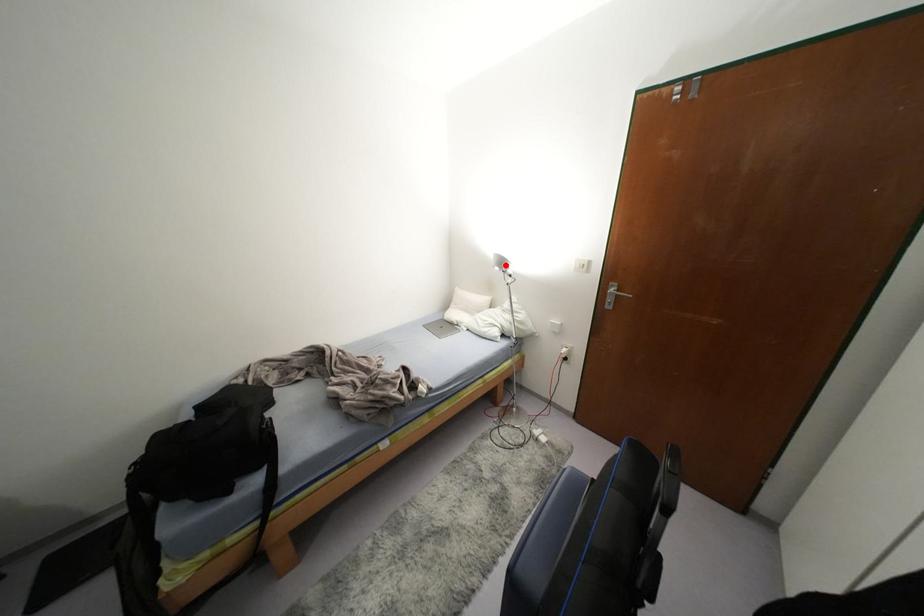
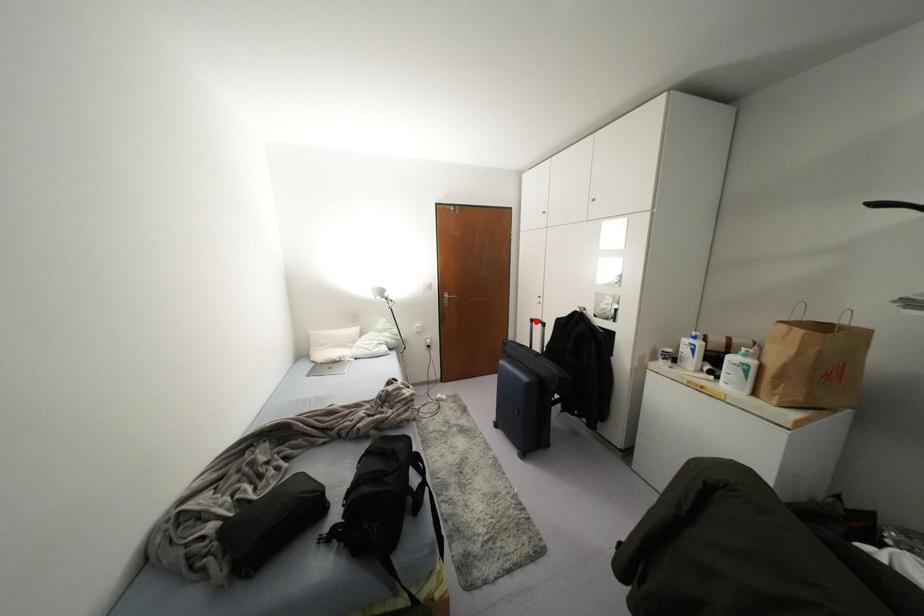
I am providing you with two images of the same scene from different viewpoints. A red point is marked on the first image and another point is marked on the second image. Does the point marked in image1 correspond to the same location as the one in image2?

No